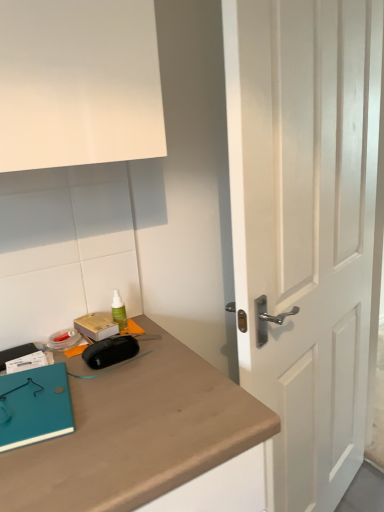
You are a GUI agent. You are given a task and a screenshot of the screen. Output one action in this format:
    pyautogui.click(x=<x>, y=<y>)
    Task: Click on the green plastic spray bottle at upper center
    The width and height of the screenshot is (384, 512).
    Given the screenshot: What is the action you would take?
    pyautogui.click(x=119, y=311)

The width and height of the screenshot is (384, 512). I want to click on teal matte notebook at lower left, so click(x=34, y=406).

Does green plastic spray bottle at upper center lie behind white wooden door at center?

Yes, it is behind white wooden door at center.

Considering the sizes of green plastic spray bottle at upper center and white wooden door at center in the image, is green plastic spray bottle at upper center taller or shorter than white wooden door at center?

green plastic spray bottle at upper center is shorter than white wooden door at center.

From the image's perspective, is white wooden door at center under teal matte notebook at lower left?

Actually, white wooden door at center appears above teal matte notebook at lower left in the image.

Measure the distance from white wooden door at center to teal matte notebook at lower left.

white wooden door at center and teal matte notebook at lower left are 30.05 inches apart from each other.

Between white wooden door at center and teal matte notebook at lower left, which one has larger width?

teal matte notebook at lower left is wider.

How many degrees apart are the facing directions of white wooden door at center and teal matte notebook at lower left?

The facing directions of white wooden door at center and teal matte notebook at lower left are 29.9 degrees apart.

How different are the orientations of white wooden door at center and green plastic spray bottle at upper center in degrees?

white wooden door at center and green plastic spray bottle at upper center are facing 14.6 degrees away from each other.

From the image's perspective, is white wooden door at center beneath green plastic spray bottle at upper center?

Actually, white wooden door at center appears above green plastic spray bottle at upper center in the image.

Based on the photo, does white wooden door at center have a lesser height compared to green plastic spray bottle at upper center?

Incorrect, the height of white wooden door at center does not fall short of that of green plastic spray bottle at upper center.

Is white wooden door at center to the right of green plastic spray bottle at upper center from the viewer's perspective?

Yes.

Where is `notebook on the left of white wooden door at center`? This screenshot has height=512, width=384. notebook on the left of white wooden door at center is located at coordinates (34, 406).

From the image's perspective, which is below, teal matte notebook at lower left or white wooden door at center?

teal matte notebook at lower left.

Is teal matte notebook at lower left in front of white wooden door at center?

No, it is behind white wooden door at center.

Is teal matte notebook at lower left bigger or smaller than white wooden door at center?

Considering their sizes, teal matte notebook at lower left takes up less space than white wooden door at center.

Which is in front, point (48, 428) or point (117, 312)?

The point (48, 428) is closer to the camera.

Is teal matte notebook at lower left next to green plastic spray bottle at upper center?

No, teal matte notebook at lower left is not in contact with green plastic spray bottle at upper center.

How different are the orientations of teal matte notebook at lower left and green plastic spray bottle at upper center in degrees?

The angle between the facing direction of teal matte notebook at lower left and the facing direction of green plastic spray bottle at upper center is 15.3 degrees.

Which of these two, teal matte notebook at lower left or green plastic spray bottle at upper center, stands shorter?

With less height is teal matte notebook at lower left.

Where is `notebook lying below the green plastic spray bottle at upper center (from the image's perspective)`? This screenshot has width=384, height=512. notebook lying below the green plastic spray bottle at upper center (from the image's perspective) is located at coordinates (34, 406).

Does green plastic spray bottle at upper center have a greater height compared to teal matte notebook at lower left?

Correct, green plastic spray bottle at upper center is much taller as teal matte notebook at lower left.

Is green plastic spray bottle at upper center not inside teal matte notebook at lower left?

Yes, green plastic spray bottle at upper center is outside of teal matte notebook at lower left.

At what (x,y) coordinates should I click in order to perform the action: click on door located above the green plastic spray bottle at upper center (from the image's perspective). Please return your answer as a coordinate pair (x, y). This screenshot has width=384, height=512. Looking at the image, I should click on click(x=305, y=226).

At what (x,y) coordinates should I click in order to perform the action: click on door below the teal matte notebook at lower left (from a real-world perspective). Please return your answer as a coordinate pair (x, y). This screenshot has height=512, width=384. Looking at the image, I should click on (305, 226).

From the image, which object appears to be farther from green plastic spray bottle at upper center, white wooden door at center or teal matte notebook at lower left?

Among the two, white wooden door at center is located further to green plastic spray bottle at upper center.

Based on the photo, which object lies nearer to the anchor point teal matte notebook at lower left, white wooden door at center or green plastic spray bottle at upper center?

The object closer to teal matte notebook at lower left is green plastic spray bottle at upper center.

Based on their spatial positions, is green plastic spray bottle at upper center or teal matte notebook at lower left further from white wooden door at center?

teal matte notebook at lower left is further to white wooden door at center.

Considering their positions, is teal matte notebook at lower left positioned closer to white wooden door at center than green plastic spray bottle at upper center?

Based on the image, green plastic spray bottle at upper center appears to be nearer to white wooden door at center.

Estimate the real-world distances between objects in this image. Which object is further from green plastic spray bottle at upper center, teal matte notebook at lower left or white wooden door at center?

white wooden door at center is further to green plastic spray bottle at upper center.

Based on their spatial positions, is green plastic spray bottle at upper center or white wooden door at center closer to teal matte notebook at lower left?

The object closer to teal matte notebook at lower left is green plastic spray bottle at upper center.

Locate an element on the screen. The height and width of the screenshot is (512, 384). stationery situated between teal matte notebook at lower left and white wooden door at center from left to right is located at coordinates (119, 311).